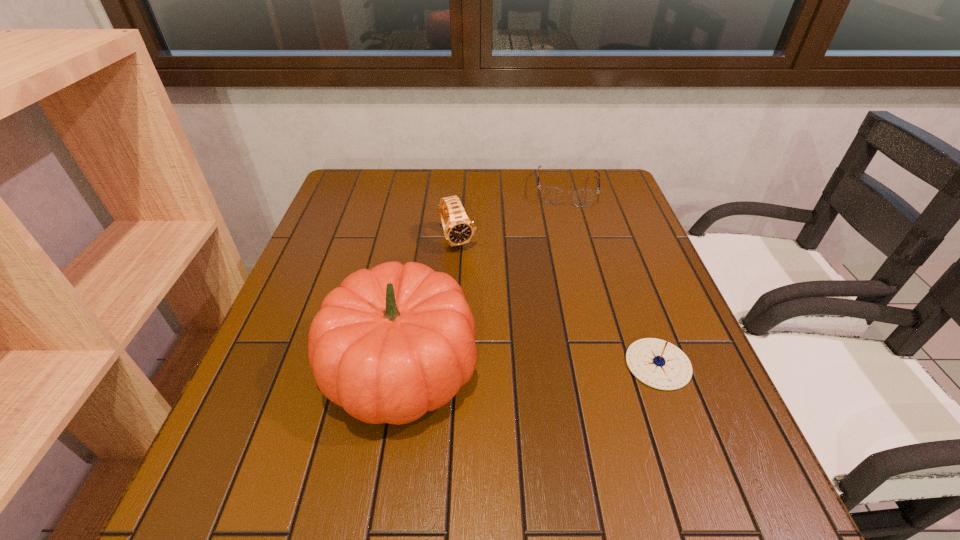
Locate an element on the screen. This screenshot has width=960, height=540. vacant spot on the desktop that is between the pumpkin and the compass and is positioned on the face of the watch is located at coordinates (525, 366).

At what (x,y) coordinates should I click in order to perform the action: click on vacant space on the desktop that is between the pumpkin and the compass and is positioned on the front-facing side of the spectacles. Please return your answer as a coordinate pair (x, y). Looking at the image, I should click on (564, 366).